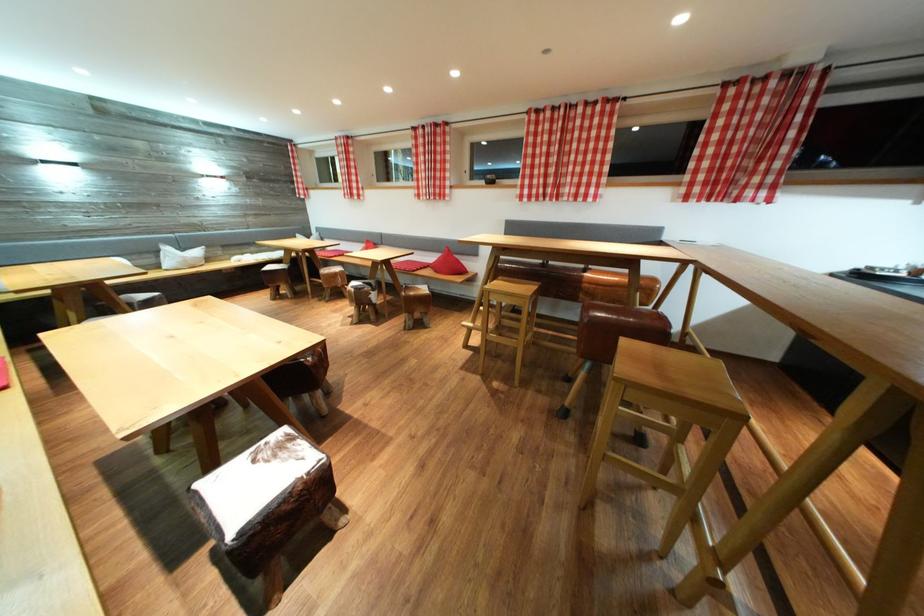
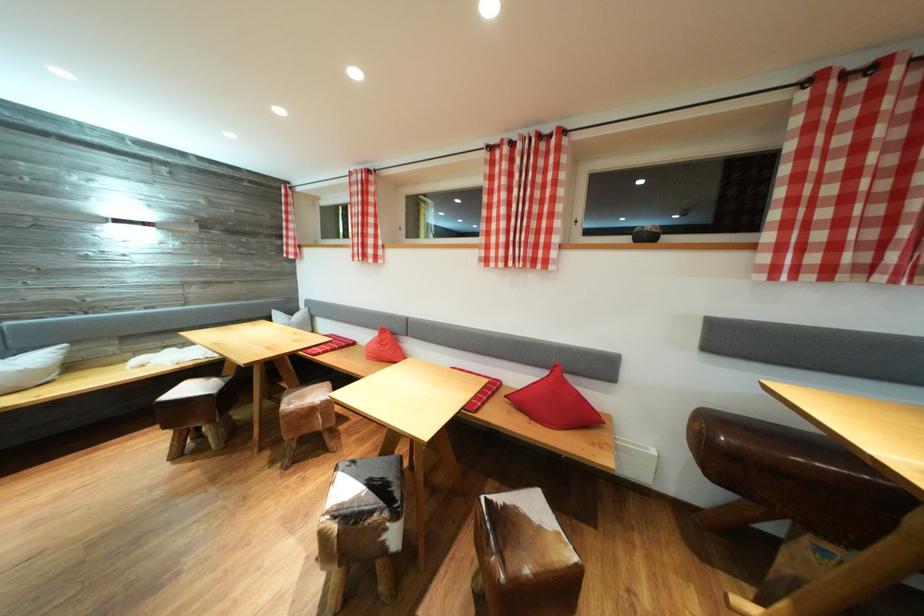
Find the pixel in the second image that matches [188,254] in the first image.

(14, 358)